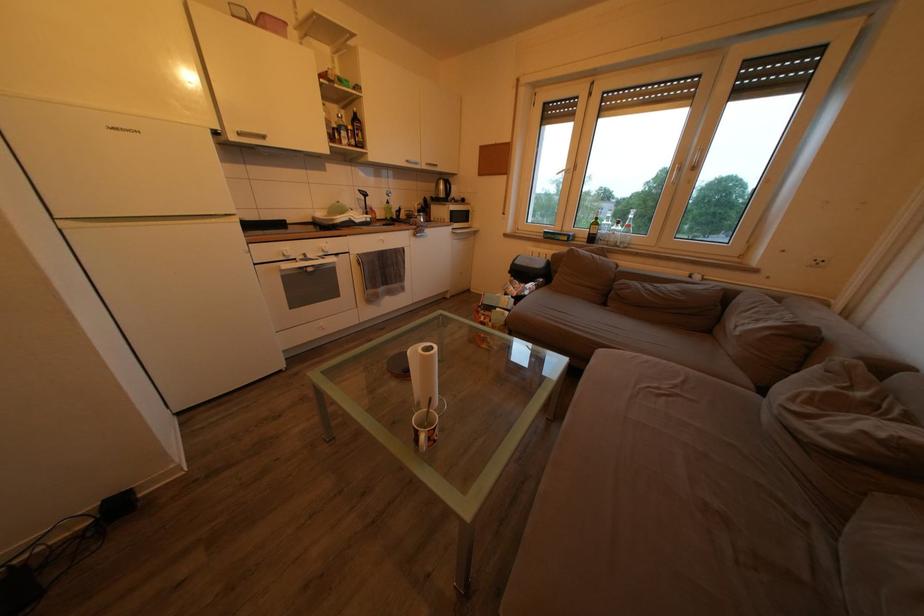
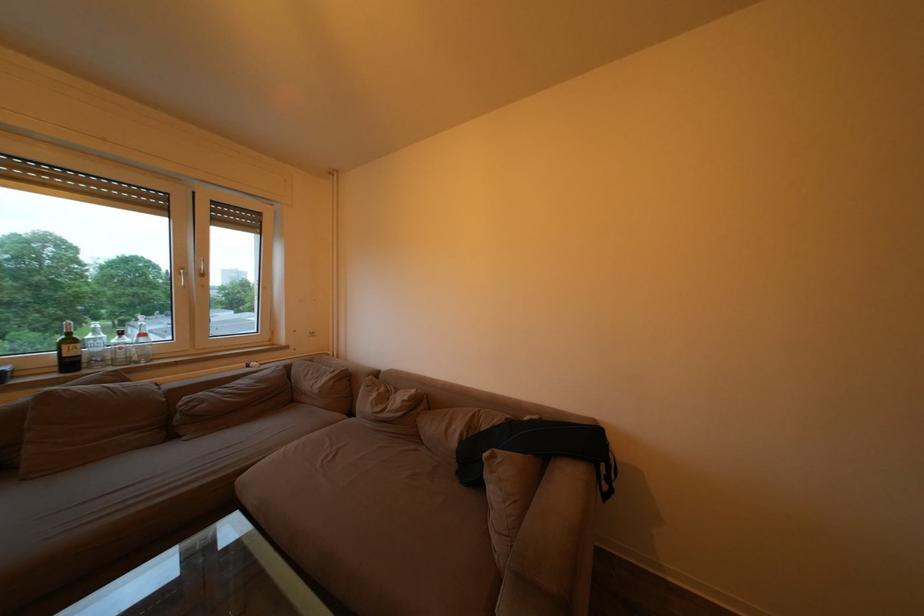
In the second image, find the point that corresponds to the point at 637,232 in the first image.

(151, 341)